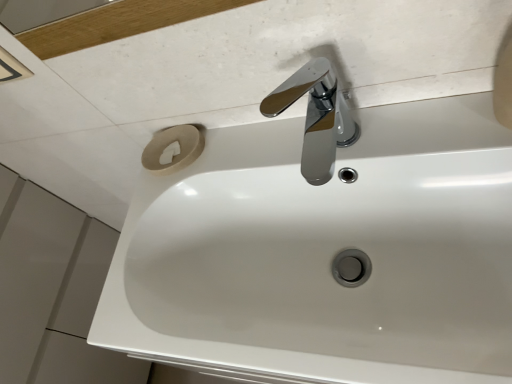
Locate an element on the screen. Image resolution: width=512 pixels, height=384 pixels. vacant space to the right of chrome/metallic faucet at upper center is located at coordinates (407, 122).